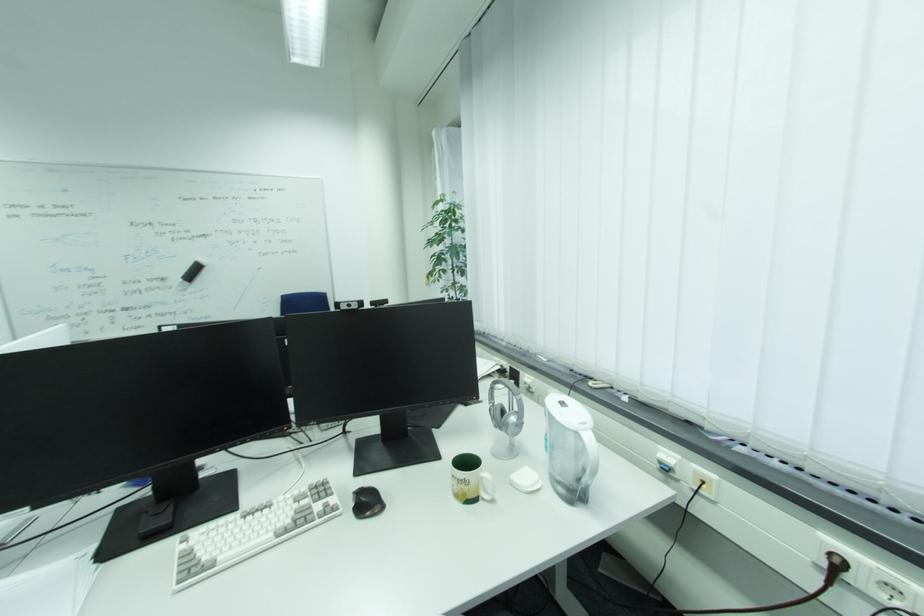
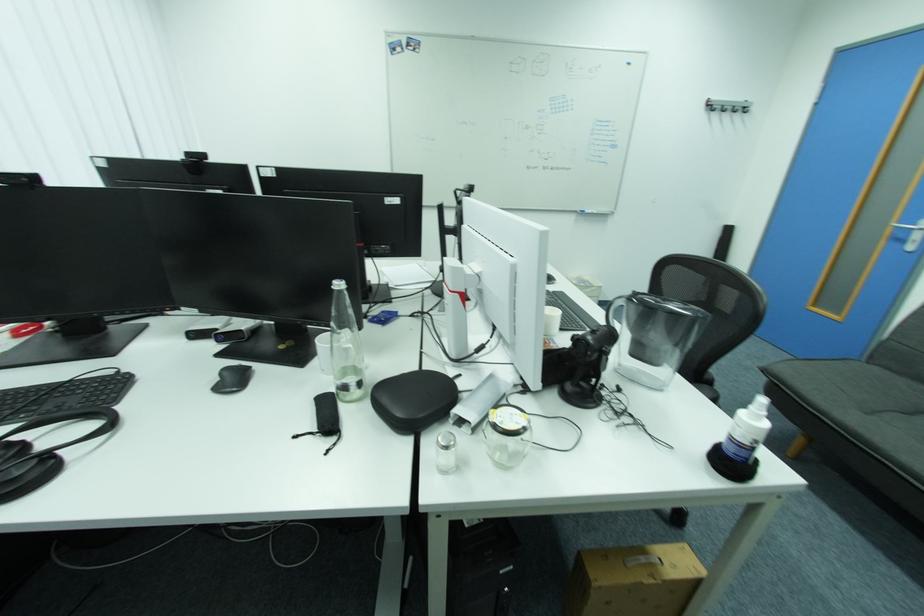
Question: I am providing you with two images of the same scene from different viewpoints. Which of the following objects are not visible in image2?

Choices:
 (A) clear glass bottle
 (B) water pitcher handle
 (C) stack of paper
 (D) bottle pump top

Answer: (B)